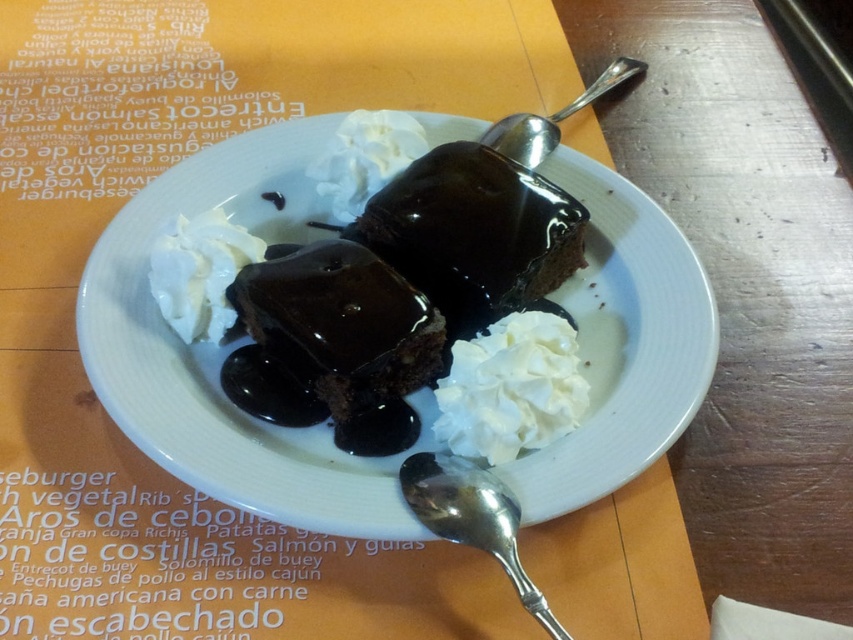
Where is `shiny dark chocolate cake at center`? Image resolution: width=853 pixels, height=640 pixels. shiny dark chocolate cake at center is located at coordinates (340, 323).

Locate an element on the screen. shiny dark chocolate cake at center is located at coordinates (340, 323).

Does white glossy plate at center appear over silver metallic spoon at upper center?

Actually, white glossy plate at center is below silver metallic spoon at upper center.

Is white glossy plate at center closer to camera compared to silver metallic spoon at upper center?

Yes, it is in front of silver metallic spoon at upper center.

Measure the distance between white glossy plate at center and camera.

The distance of white glossy plate at center from camera is 1.19 meters.

Identify the location of white glossy plate at center. (224, 348).

Who is lower down, white glossy plate at center or white fluffy cream at upper left?

white glossy plate at center is below.

Which is in front, point (585, 452) or point (250, 241)?

Positioned in front is point (585, 452).

In order to click on white glossy plate at center in this screenshot , I will do `click(224, 348)`.